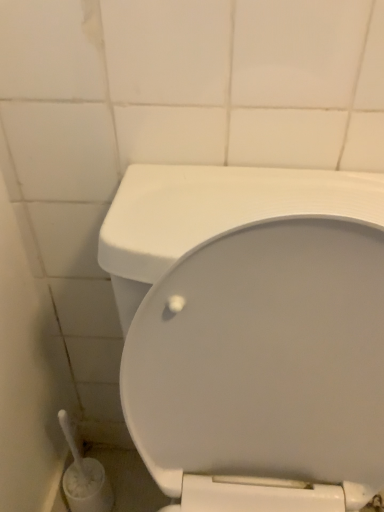
What do you see at coordinates (252, 333) in the screenshot?
I see `white glossy toilet at center` at bounding box center [252, 333].

The width and height of the screenshot is (384, 512). In order to click on white glossy toilet at center in this screenshot , I will do `click(252, 333)`.

I want to click on white glossy toilet at center, so click(x=252, y=333).